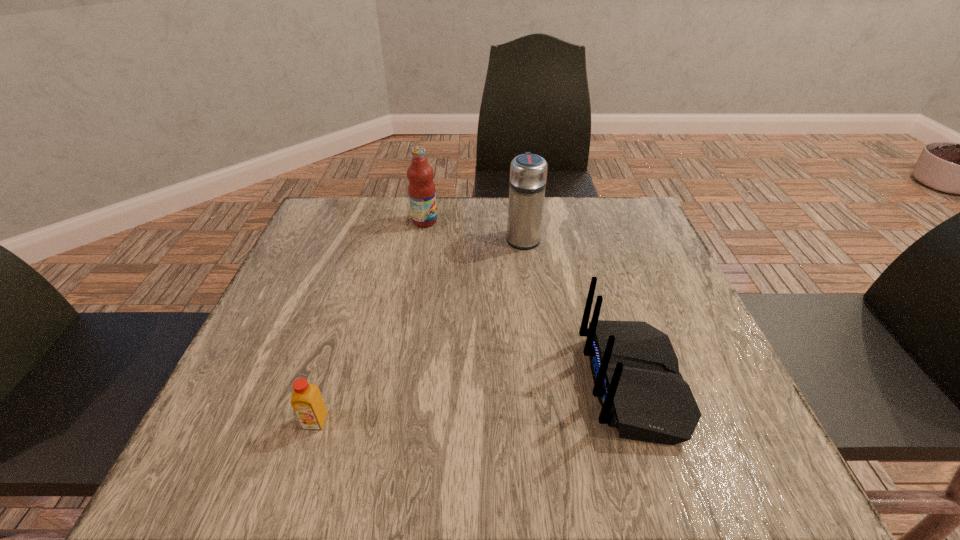
Where is `blank region between the leftmost object and the fruit juice`? blank region between the leftmost object and the fruit juice is located at coordinates (371, 321).

Where is `vacant area between the second object from left to right and the orange juice`? This screenshot has width=960, height=540. vacant area between the second object from left to right and the orange juice is located at coordinates (371, 321).

Image resolution: width=960 pixels, height=540 pixels. Identify the location of free point between the second object from right to left and the third tallest object. (578, 310).

Where is `free space between the router and the fruit juice`? Image resolution: width=960 pixels, height=540 pixels. free space between the router and the fruit juice is located at coordinates (529, 302).

Image resolution: width=960 pixels, height=540 pixels. I want to click on free area in between the thermos bottle and the orange juice, so (420, 329).

This screenshot has height=540, width=960. Find the location of `free space between the third object from left to right and the fruit juice`. free space between the third object from left to right and the fruit juice is located at coordinates (474, 230).

At what (x,y) coordinates should I click in order to perform the action: click on free space that is in between the leftmost object and the second object from left to right. Please return your answer as a coordinate pair (x, y). This screenshot has width=960, height=540. Looking at the image, I should click on point(371,321).

Where is `free space between the orange juice and the thermos bottle`? free space between the orange juice and the thermos bottle is located at coordinates (420, 329).

Choose which object is the third nearest neighbor to the thermos bottle. Please provide its 2D coordinates. Your answer should be formatted as a tuple, i.e. [(x, y)], where the tuple contains the x and y coordinates of a point satisfying the conditions above.

[(307, 402)]

Choose which object is the second nearest neighbor to the third object from left to right. Please provide its 2D coordinates. Your answer should be formatted as a tuple, i.e. [(x, y)], where the tuple contains the x and y coordinates of a point satisfying the conditions above.

[(635, 370)]